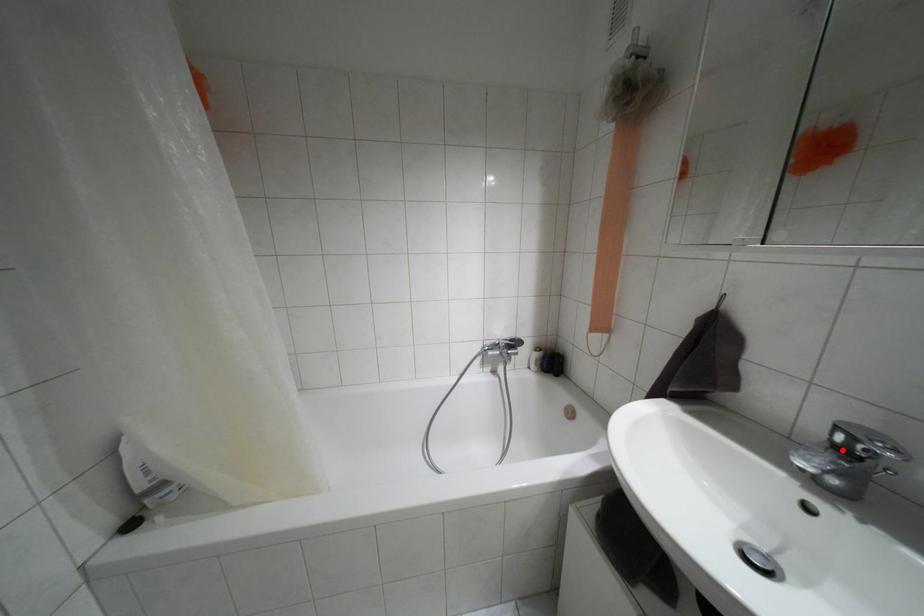
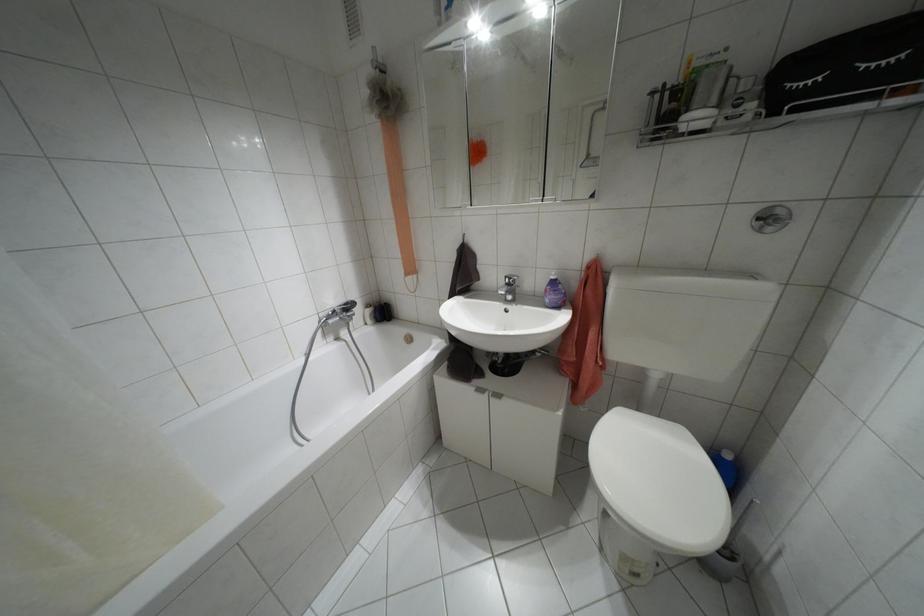
Find the pixel in the second image that matches the highlighted location in the first image.

(507, 284)